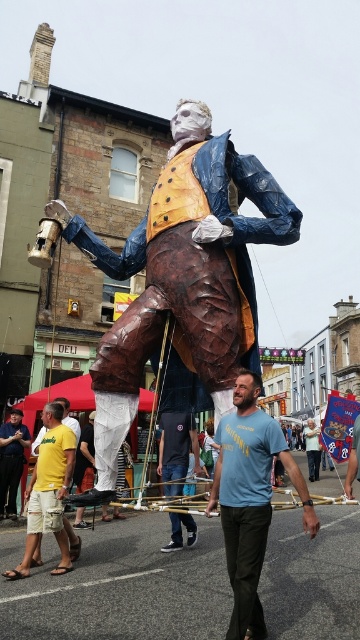
Between blue cotton t-shirt at center and matte blue shirt at center, which one appears on the right side from the viewer's perspective?

blue cotton t-shirt at center is more to the right.

Can you confirm if blue cotton t-shirt at center is positioned below matte blue shirt at center?

No, blue cotton t-shirt at center is not below matte blue shirt at center.

This screenshot has height=640, width=360. Find the location of `blue cotton t-shirt at center`. blue cotton t-shirt at center is located at coordinates (249, 499).

Between bronze statue at center and blue cotton t-shirt at center, which one is positioned lower?

blue cotton t-shirt at center is below.

Who is positioned more to the left, bronze statue at center or blue cotton t-shirt at center?

bronze statue at center

Does point (136, 316) lie behind point (228, 561)?

Yes, point (136, 316) is behind point (228, 561).

The image size is (360, 640). I want to click on bronze statue at center, so click(x=183, y=276).

Which is in front, point (199, 301) or point (5, 440)?

Point (199, 301) is more forward.

Who is more distant from viewer, (186,381) or (14,488)?

The point (14,488) is more distant.

The height and width of the screenshot is (640, 360). What do you see at coordinates (183, 276) in the screenshot?
I see `bronze statue at center` at bounding box center [183, 276].

The height and width of the screenshot is (640, 360). I want to click on bronze statue at center, so click(x=183, y=276).